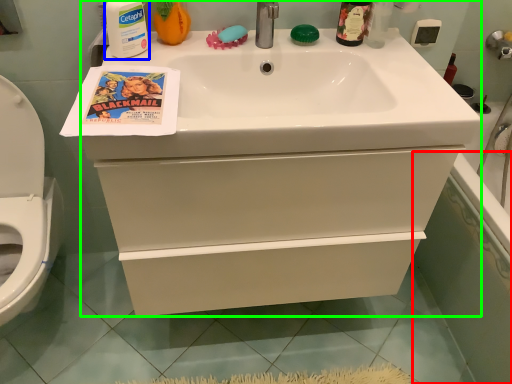
Question: Which object is the farthest from bath (highlighted by a red box)? Choose among these: cleaning product (highlighted by a blue box) or bathroom cabinet (highlighted by a green box).

Choices:
 (A) cleaning product
 (B) bathroom cabinet

Answer: (A)